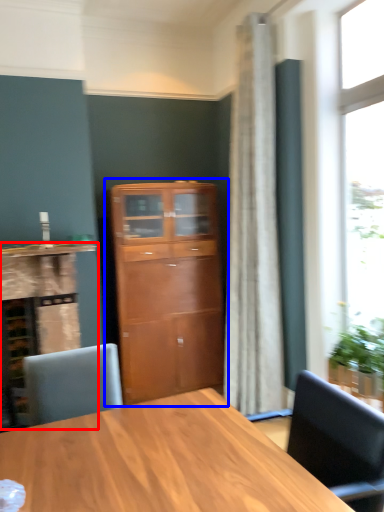
Question: Which object is closer to the camera taking this photo, cabinetry (highlighted by a red box) or cupboard (highlighted by a blue box)?

Choices:
 (A) cabinetry
 (B) cupboard

Answer: (A)